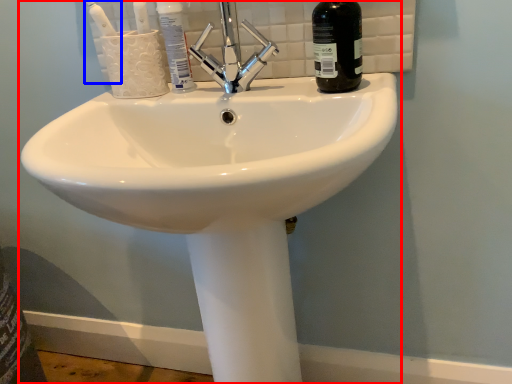
Question: Which point is closer to the camera, sink (highlighted by a red box) or toothbrush (highlighted by a blue box)?

Choices:
 (A) sink
 (B) toothbrush

Answer: (A)